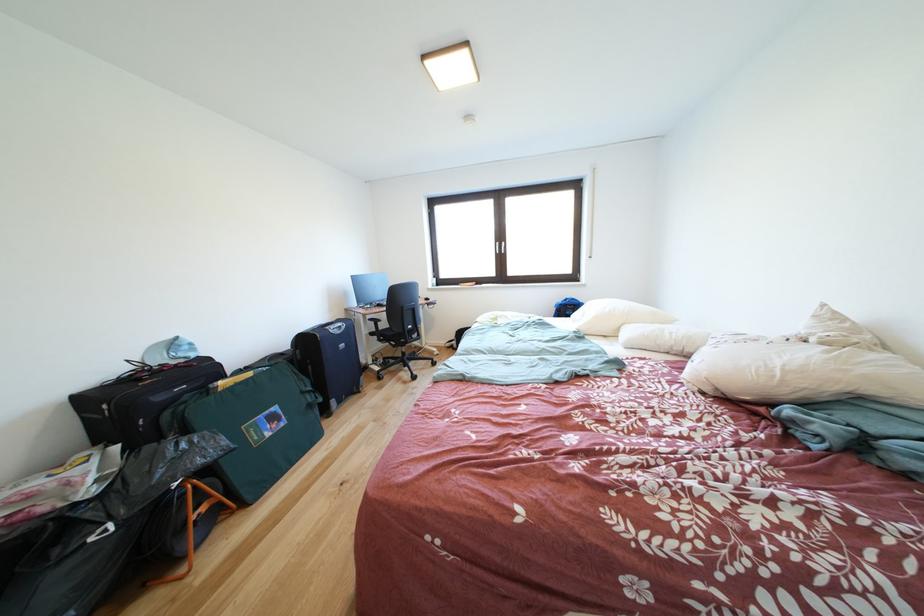
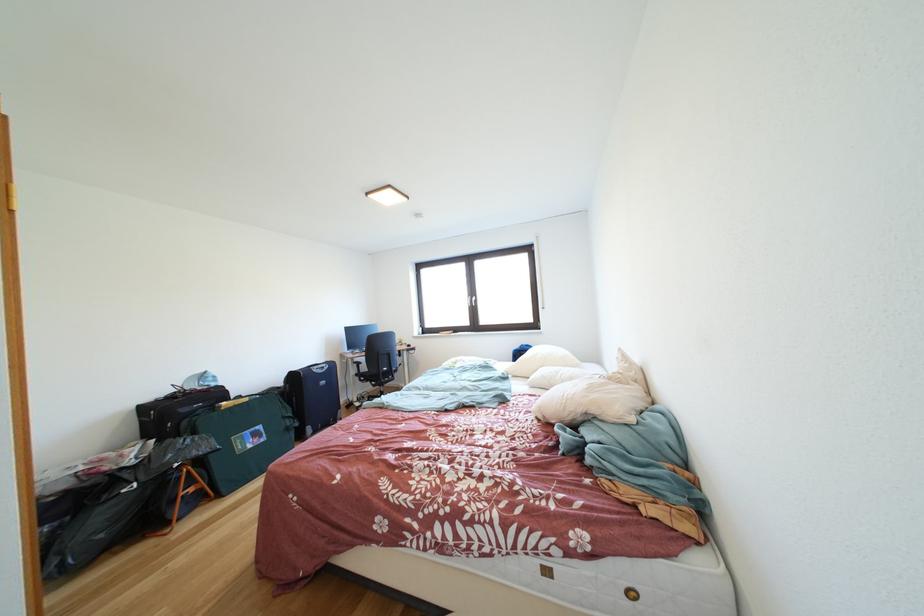
Locate, in the second image, the point that corresponds to pixel 202 360 in the first image.

(222, 389)